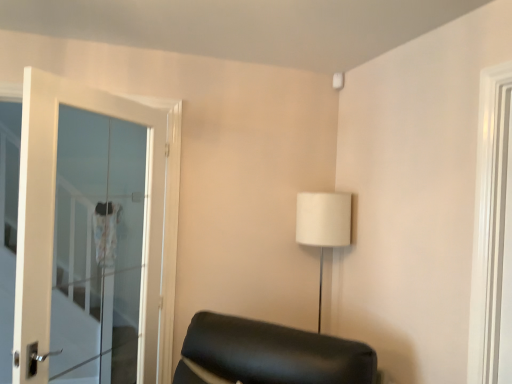
Image resolution: width=512 pixels, height=384 pixels. What do you see at coordinates (54, 216) in the screenshot? I see `white glass door at left` at bounding box center [54, 216].

What do you see at coordinates (323, 225) in the screenshot? I see `white fabric lampshade at upper right` at bounding box center [323, 225].

This screenshot has width=512, height=384. Describe the element at coordinates (492, 233) in the screenshot. I see `white glossy door at right` at that location.

At what (x,y) coordinates should I click in order to perform the action: click on white glass door at left. Please return your answer as a coordinate pair (x, y). Image resolution: width=512 pixels, height=384 pixels. Looking at the image, I should click on (54, 216).

Between white glossy door at right and white glass door at left, which one has smaller width?

white glossy door at right.

In terms of height, does white glossy door at right look taller or shorter compared to white glass door at left?

In the image, white glossy door at right appears to be shorter than white glass door at left.

Would you say white glossy door at right is to the left or to the right of white glass door at left in the picture?

white glossy door at right is positioned on white glass door at left's right side.

Which is nearer, (490, 301) or (27, 231)?

Point (490, 301) appears to be farther away from the viewer than point (27, 231).

Consider the image. Can white fabric lampshade at upper right be found inside white glossy door at right?

No, white fabric lampshade at upper right is not a part of white glossy door at right.

Considering the sizes of white glossy door at right and white fabric lampshade at upper right in the image, is white glossy door at right bigger or smaller than white fabric lampshade at upper right?

In the image, white glossy door at right appears to be smaller than white fabric lampshade at upper right.

Is white glossy door at right next to white fabric lampshade at upper right?

white glossy door at right and white fabric lampshade at upper right are not in contact.

Is white glossy door at right at the right side of white fabric lampshade at upper right?

Correct, you'll find white glossy door at right to the right of white fabric lampshade at upper right.

Between white glass door at left and white glossy door at right, which one has larger width?

With larger width is white glass door at left.

Considering the points (49, 206) and (508, 128), which point is behind, point (49, 206) or point (508, 128)?

The point (49, 206) is behind.

From a real-world perspective, who is located lower, white glass door at left or white glossy door at right?

From a 3D spatial view, white glass door at left is below.

From the image's perspective, is white glass door at left on white glossy door at right?

Incorrect, from the image's perspective, white glass door at left is lower than white glossy door at right.

This screenshot has height=384, width=512. Identify the location of window in front of the white fabric lampshade at upper right. (492, 233).

Considering the positions of points (325, 216) and (504, 171), is point (325, 216) farther from camera compared to point (504, 171)?

That is True.

Could you tell me if white fabric lampshade at upper right is facing white glossy door at right?

No, white fabric lampshade at upper right is not turned towards white glossy door at right.

How far apart are white fabric lampshade at upper right and white glossy door at right?

The distance of white fabric lampshade at upper right from white glossy door at right is 33.50 inches.

Is white fabric lampshade at upper right not inside white glass door at left?

white fabric lampshade at upper right is positioned outside white glass door at left.

From a real-world perspective, is white fabric lampshade at upper right located beneath white glass door at left?

Indeed, from a real-world perspective, white fabric lampshade at upper right is positioned beneath white glass door at left.

Are white fabric lampshade at upper right and white glass door at left making contact?

No, white fabric lampshade at upper right is not beside white glass door at left.

Is white glass door at left next to white fabric lampshade at upper right and touching it?

white glass door at left and white fabric lampshade at upper right are not in contact.

From the picture: From a real-world perspective, which object rests below the other?

white fabric lampshade at upper right, from a real-world perspective.

Is white glass door at left wider or thinner than white fabric lampshade at upper right?

Clearly, white glass door at left has less width compared to white fabric lampshade at upper right.

You are a GUI agent. You are given a task and a screenshot of the screen. Output one action in this format:
    pyautogui.click(x=<x>, y=<y>)
    Task: Click on the table lamp behind the white glass door at left
    
    Given the screenshot: What is the action you would take?
    pyautogui.click(x=323, y=225)

The width and height of the screenshot is (512, 384). Identify the location of door beneath the white glossy door at right (from a real-world perspective). (54, 216).

Locate an element on the screen. window in front of the white fabric lampshade at upper right is located at coordinates (492, 233).

Based on the photo, from the image, which object appears to be farther from white glass door at left, white glossy door at right or white fabric lampshade at upper right?

Based on the image, white glossy door at right appears to be further to white glass door at left.

When comparing their distances from white fabric lampshade at upper right, does white glass door at left or white glossy door at right seem further?

white glass door at left is further to white fabric lampshade at upper right.

Looking at the image, which one is located closer to white glass door at left, white fabric lampshade at upper right or white glossy door at right?

Result: Among the two, white fabric lampshade at upper right is located nearer to white glass door at left.

Which object lies further to the anchor point white glossy door at right, white glass door at left or white fabric lampshade at upper right?

The object further to white glossy door at right is white glass door at left.

From the image, which object appears to be nearer to white fabric lampshade at upper right, white glossy door at right or white glass door at left?

white glossy door at right is positioned closer to the anchor white fabric lampshade at upper right.

When comparing their distances from white glossy door at right, does white fabric lampshade at upper right or white glass door at left seem closer?

white fabric lampshade at upper right is closer to white glossy door at right.

Identify the location of table lamp between white glass door at left and white glossy door at right from left to right. (323, 225).